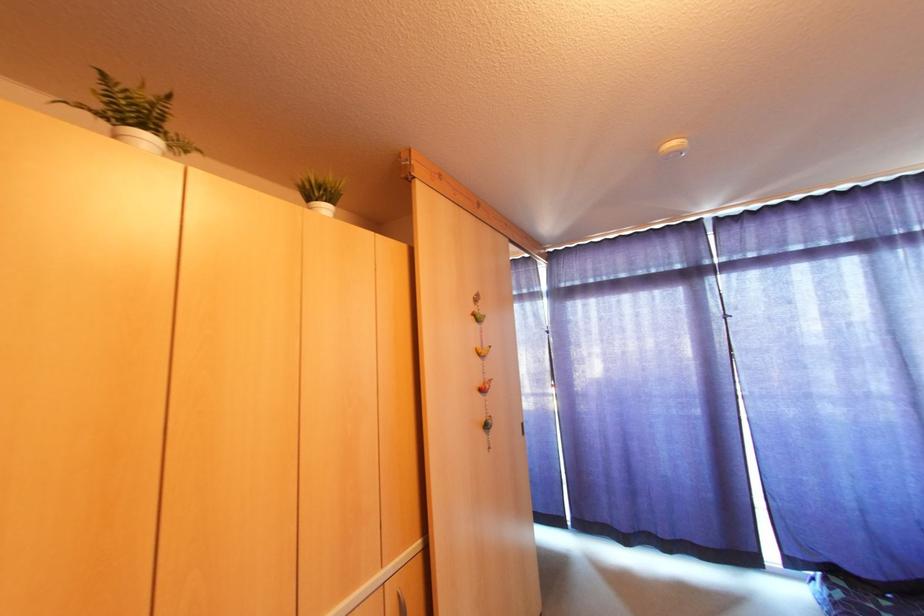
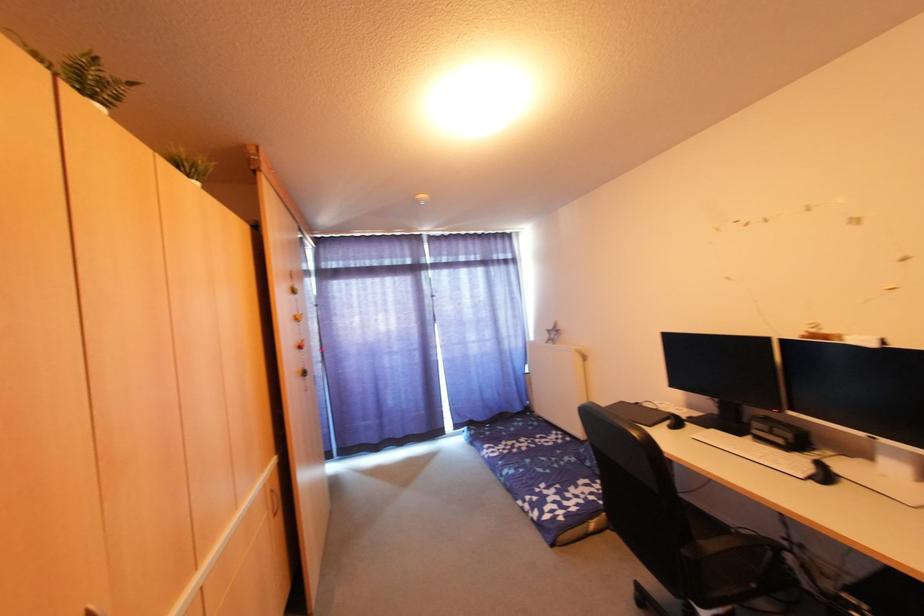
The point at (324, 201) is marked in the first image. Where is the corresponding point in the second image?

(195, 180)